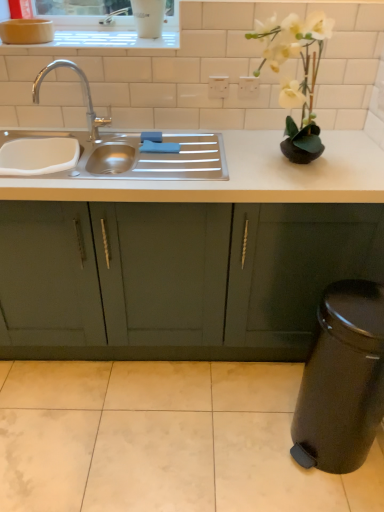
Locate an element on the screen. This screenshot has width=384, height=512. white ceramic window sill at upper center is located at coordinates (95, 42).

Who is bigger, matte green cabinets at center or stainless steel sink at left?

matte green cabinets at center is bigger.

Is point (275, 213) closer to camera compared to point (92, 131)?

Yes, it is in front of point (92, 131).

Which object is wider, matte green cabinets at center or stainless steel sink at left?

Wider between the two is matte green cabinets at center.

Considering the positions of objects stainless steel sink at left and white matte vase at upper right in the image provided, who is more to the right, stainless steel sink at left or white matte vase at upper right?

white matte vase at upper right.

Which is behind, stainless steel sink at left or white matte vase at upper right?

stainless steel sink at left is further away from the camera.

From the image's perspective, would you say stainless steel sink at left is positioned over white matte vase at upper right?

No.

Does white ceramic window sill at upper center appear on the right side of stainless steel sink at left?

No, white ceramic window sill at upper center is not to the right of stainless steel sink at left.

Can you tell me how much white ceramic window sill at upper center and stainless steel sink at left differ in facing direction?

There is a 0.374-degree angle between the facing directions of white ceramic window sill at upper center and stainless steel sink at left.

Considering the sizes of objects white ceramic window sill at upper center and stainless steel sink at left in the image provided, who is shorter, white ceramic window sill at upper center or stainless steel sink at left?

white ceramic window sill at upper center.

Based on the photo, is white ceramic window sill at upper center facing towards stainless steel sink at left?

No, white ceramic window sill at upper center does not turn towards stainless steel sink at left.

Is white matte vase at upper right oriented towards white ceramic window sill at upper center?

No.

From a real-world perspective, which is physically below, white matte vase at upper right or white ceramic window sill at upper center?

white matte vase at upper right.

From the image's perspective, is white matte vase at upper right positioned above or below white ceramic window sill at upper center?

Based on their image positions, white matte vase at upper right is located beneath white ceramic window sill at upper center.

Is stainless steel sink at left in front of white ceramic window sill at upper center?

Yes, stainless steel sink at left is closer to the viewer.

From the image's perspective, is stainless steel sink at left located beneath white ceramic window sill at upper center?

Yes, from the image's perspective, stainless steel sink at left is below white ceramic window sill at upper center.

Would you consider stainless steel sink at left to be distant from white ceramic window sill at upper center?

stainless steel sink at left is near white ceramic window sill at upper center, not far away.

How different are the orientations of stainless steel sink at left and white ceramic window sill at upper center in degrees?

stainless steel sink at left and white ceramic window sill at upper center are facing 0.374 degrees away from each other.

Is point (315, 62) farther from camera compared to point (115, 274)?

No, (315, 62) is closer to viewer.

Is white matte vase at upper right directly adjacent to matte green cabinets at center?

Result: No, white matte vase at upper right is not touching matte green cabinets at center.

Is white matte vase at upper right at the right side of matte green cabinets at center?

Indeed, white matte vase at upper right is positioned on the right side of matte green cabinets at center.

Is matte green cabinets at center touching white matte vase at upper right?

No, matte green cabinets at center is not with white matte vase at upper right.

Could you tell me if matte green cabinets at center is turned towards white matte vase at upper right?

No, matte green cabinets at center does not turn towards white matte vase at upper right.

From a real-world perspective, is matte green cabinets at center on white matte vase at upper right?

No, from a real-world perspective, matte green cabinets at center is not above white matte vase at upper right.

Is matte green cabinets at center outside of white matte vase at upper right?

Absolutely, matte green cabinets at center is external to white matte vase at upper right.

The image size is (384, 512). What are the coordinates of `cabinetry lying below the stainless steel sink at left (from the image's perspective)` in the screenshot? It's located at (191, 279).

Find the location of a particular element. floral arrangement above the stainless steel sink at left (from the image's perspective) is located at coordinates (296, 80).

When comparing their distances from stainless steel sink at left, does matte green cabinets at center or white matte vase at upper right seem closer?

Among the two, matte green cabinets at center is located nearer to stainless steel sink at left.

When comparing their distances from matte green cabinets at center, does white matte vase at upper right or white ceramic window sill at upper center seem further?

white ceramic window sill at upper center lies further to matte green cabinets at center than the other object.

Which object lies further to the anchor point matte green cabinets at center, white matte vase at upper right or stainless steel sink at left?

Based on the image, white matte vase at upper right appears to be further to matte green cabinets at center.

Based on their spatial positions, is white matte vase at upper right or matte green cabinets at center closer to stainless steel sink at left?

matte green cabinets at center.

Considering their positions, is white ceramic window sill at upper center positioned closer to white matte vase at upper right than matte green cabinets at center?

matte green cabinets at center is positioned closer to the anchor white matte vase at upper right.

When comparing their distances from white ceramic window sill at upper center, does matte green cabinets at center or white matte vase at upper right seem further?

Based on the image, matte green cabinets at center appears to be further to white ceramic window sill at upper center.

Considering their positions, is stainless steel sink at left positioned further to matte green cabinets at center than white ceramic window sill at upper center?

white ceramic window sill at upper center is further to matte green cabinets at center.

In the scene shown: When comparing their distances from white ceramic window sill at upper center, does stainless steel sink at left or white matte vase at upper right seem further?

Among the two, white matte vase at upper right is located further to white ceramic window sill at upper center.

You are a GUI agent. You are given a task and a screenshot of the screen. Output one action in this format:
    pyautogui.click(x=<x>, y=<y>)
    Task: Click on the sink between white ceramic window sill at upper center and white matte vase at upper right from left to right
    The image size is (384, 512).
    Given the screenshot: What is the action you would take?
    pyautogui.click(x=133, y=147)

Where is `cabinetry between stainless steel sink at left and white matte vase at upper right from left to right`? cabinetry between stainless steel sink at left and white matte vase at upper right from left to right is located at coordinates (191, 279).

You are a GUI agent. You are given a task and a screenshot of the screen. Output one action in this format:
    pyautogui.click(x=<x>, y=<y>)
    Task: Click on the floral arrangement between white ceramic window sill at upper center and matte green cabinets at center in the up-down direction
    Image resolution: width=384 pixels, height=512 pixels.
    Given the screenshot: What is the action you would take?
    pyautogui.click(x=296, y=80)

The height and width of the screenshot is (512, 384). I want to click on sink between white ceramic window sill at upper center and matte green cabinets at center vertically, so click(x=133, y=147).